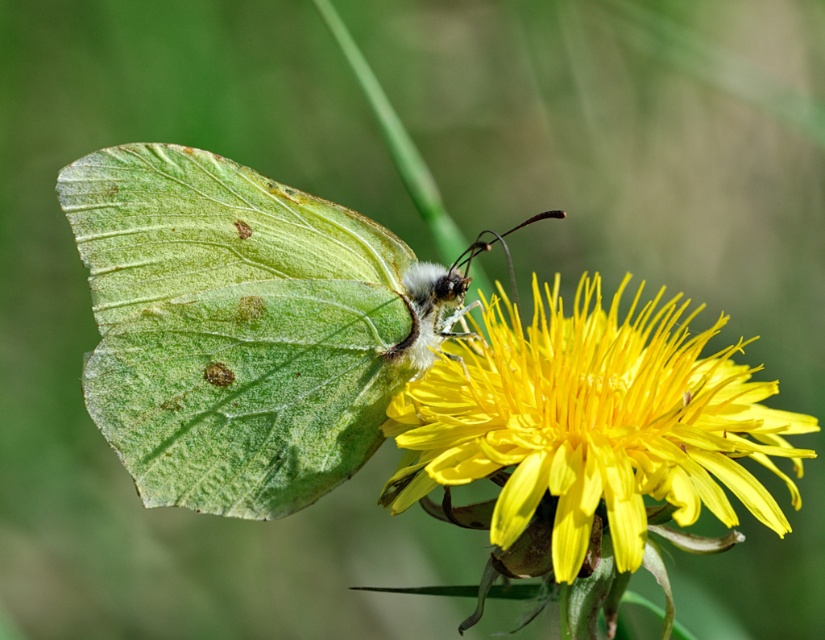
Who is shorter, green matte butterfly at center or yellow matte flower at center?

With less height is yellow matte flower at center.

Is point (218, 422) positioned behind point (700, 408)?

Yes, point (218, 422) is behind point (700, 408).

Locate an element on the screen. green matte butterfly at center is located at coordinates (234, 328).

Identify the location of green matte butterfly at center. (234, 328).